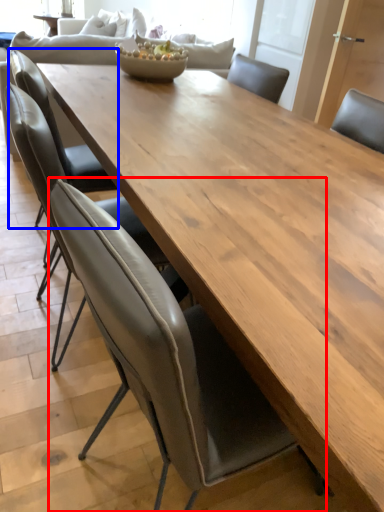
Question: Which point is closer to the camera, chair (highlighted by a red box) or chair (highlighted by a blue box)?

Choices:
 (A) chair
 (B) chair

Answer: (A)